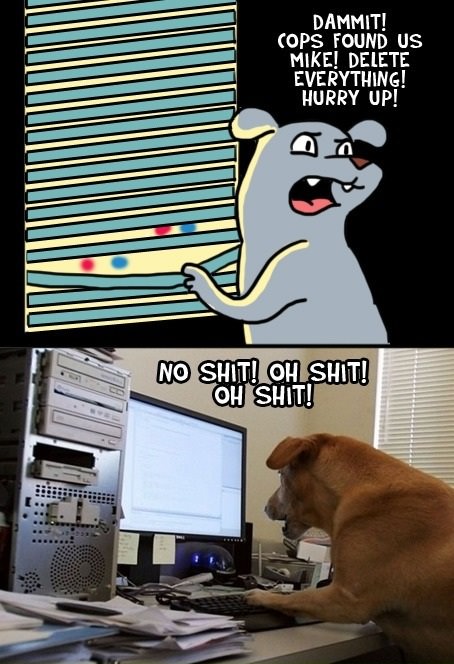
The width and height of the screenshot is (454, 664). Find the location of `computer screen`. computer screen is located at coordinates (174, 461).